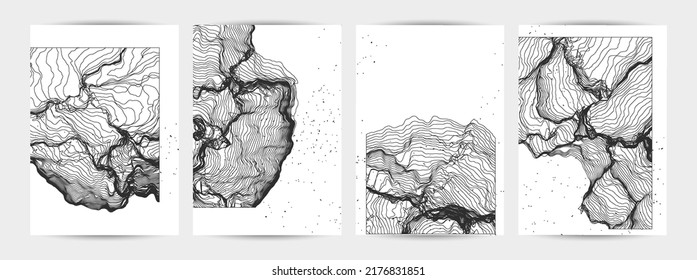
The height and width of the screenshot is (280, 697). I want to click on space below pictures, so click(369, 248).